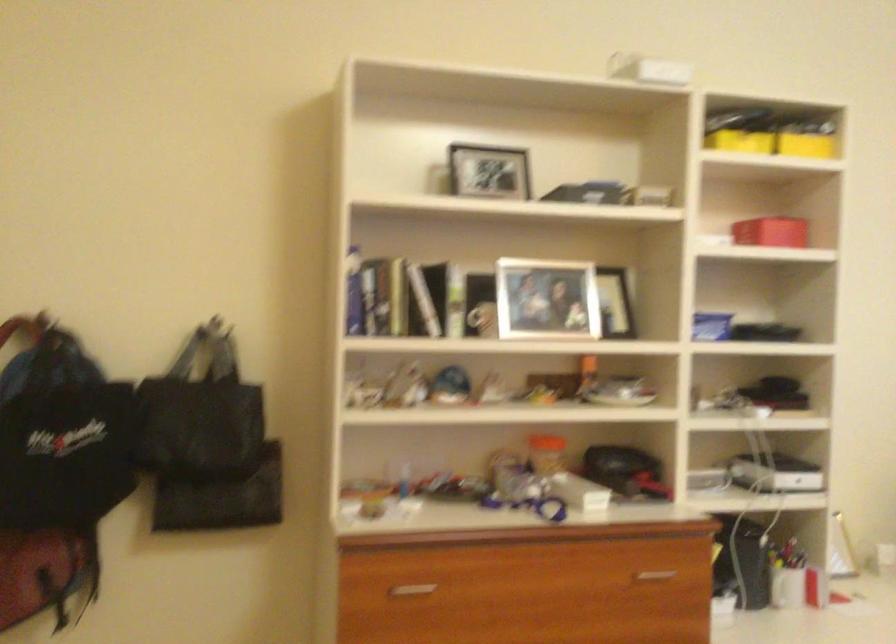
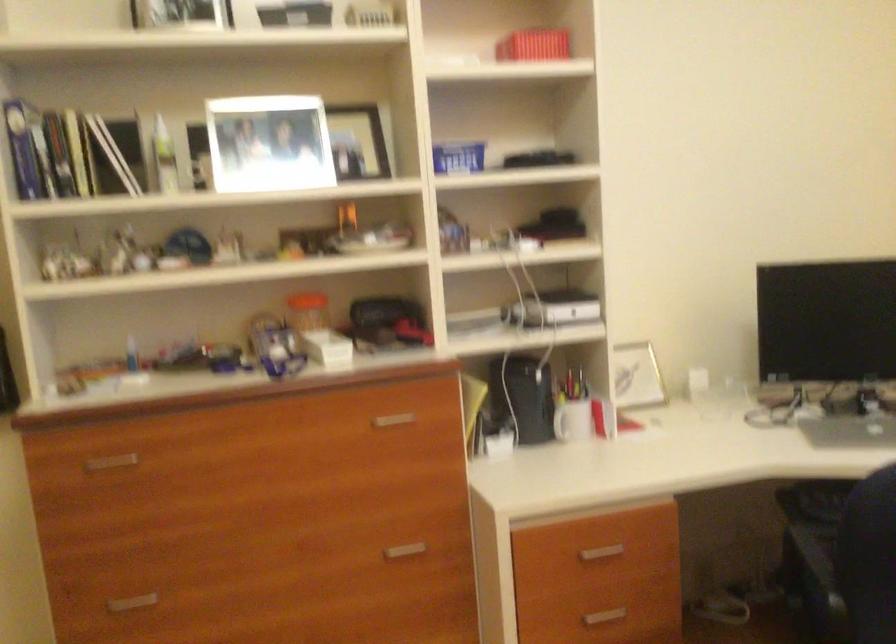
Question: How did the camera likely rotate?

Choices:
 (A) Left
 (B) Right
 (C) Up
 (D) Down

Answer: (D)